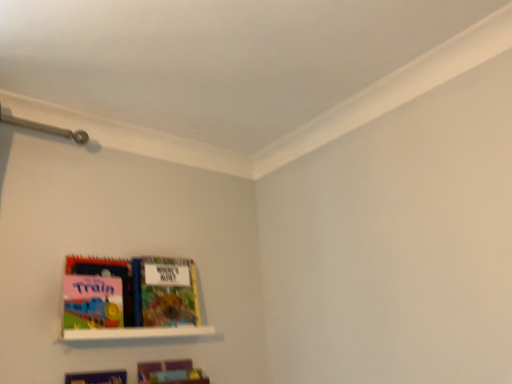
The height and width of the screenshot is (384, 512). What are the coordinates of `matte plastic book at lower left, placed as the 2th book when sorted from top to bottom` in the screenshot? It's located at [170, 372].

You are a GUI agent. You are given a task and a screenshot of the screen. Output one action in this format:
    pyautogui.click(x=<x>, y=<y>)
    Task: Click on the white glossy shelf at lower left
    
    Given the screenshot: What is the action you would take?
    pyautogui.click(x=136, y=333)

Is multicolored paper book at center, marked as the second book in a bottom-to-top arrangement, situated inside white glossy shelf at lower left or outside?

multicolored paper book at center, marked as the second book in a bottom-to-top arrangement, exists outside the volume of white glossy shelf at lower left.

From a real-world perspective, is multicolored paper book at center, which appears as the first book when viewed from the top, positioned above or below white glossy shelf at lower left?

In terms of real-world spatial position, multicolored paper book at center, which appears as the first book when viewed from the top, is above white glossy shelf at lower left.

Is multicolored paper book at center, which appears as the first book when viewed from the top, taller than white glossy shelf at lower left?

Yes, multicolored paper book at center, which appears as the first book when viewed from the top, is taller than white glossy shelf at lower left.

At what (x,y) coordinates should I click in order to perform the action: click on the 2nd book behind the white glossy shelf at lower left, counting from the anchor's position. Please return your answer as a coordinate pair (x, y). Looking at the image, I should click on (164, 292).

Which is more to the left, matte plastic book at lower left, placed as the 2th book when sorted from top to bottom, or multicolored paper book at center, marked as the second book in a bottom-to-top arrangement?

Positioned to the left is multicolored paper book at center, marked as the second book in a bottom-to-top arrangement.

How different are the orientations of matte plastic book at lower left, placed as the 2th book when sorted from top to bottom, and multicolored paper book at center, marked as the second book in a bottom-to-top arrangement, in degrees?

They differ by 1.22 degrees in their facing directions.

Between matte plastic book at lower left, placed as the 2th book when sorted from top to bottom, and multicolored paper book at center, marked as the second book in a bottom-to-top arrangement, which one is positioned in front?

Positioned in front is matte plastic book at lower left, placed as the 2th book when sorted from top to bottom.

Is multicolored paper book at center, marked as the second book in a bottom-to-top arrangement, surrounded by matte plastic book at lower left, placed as the 2th book when sorted from top to bottom?

Actually, multicolored paper book at center, marked as the second book in a bottom-to-top arrangement, is outside matte plastic book at lower left, placed as the 2th book when sorted from top to bottom.

Would you say white glossy shelf at lower left is a long distance from matte plastic book at lower left, placed as the 2th book when sorted from top to bottom?

No, white glossy shelf at lower left is not far from matte plastic book at lower left, placed as the 2th book when sorted from top to bottom.

Who is taller, white glossy shelf at lower left or matte plastic book at lower left, placed as the 2th book when sorted from top to bottom?

With more height is matte plastic book at lower left, placed as the 2th book when sorted from top to bottom.

Which of these two, white glossy shelf at lower left or matte plastic book at lower left, placed as the 2th book when sorted from top to bottom, is bigger?

white glossy shelf at lower left.

Looking at their sizes, would you say white glossy shelf at lower left is wider or thinner than matte plastic book at lower left, marked as the 1th book in a bottom-to-top arrangement?

In the image, white glossy shelf at lower left appears to be wider than matte plastic book at lower left, marked as the 1th book in a bottom-to-top arrangement.

Does multicolored paper book at center, which appears as the first book when viewed from the top, appear on the left side of matte plastic book at lower left, marked as the 1th book in a bottom-to-top arrangement?

Correct, you'll find multicolored paper book at center, which appears as the first book when viewed from the top, to the left of matte plastic book at lower left, marked as the 1th book in a bottom-to-top arrangement.

Find the location of a particular element. This screenshot has height=384, width=512. book behind the matte plastic book at lower left, marked as the 1th book in a bottom-to-top arrangement is located at coordinates (164, 292).

From a real-world perspective, does matte plastic book at lower left, placed as the 2th book when sorted from top to bottom, sit lower than white glossy shelf at lower left?

Yes.

Considering the positions of point (193, 381) and point (64, 332), is point (193, 381) closer or farther from the camera than point (64, 332)?

Point (193, 381) appears to be farther away from the viewer than point (64, 332).

Is matte plastic book at lower left, placed as the 2th book when sorted from top to bottom, facing away from white glossy shelf at lower left?

No, matte plastic book at lower left, placed as the 2th book when sorted from top to bottom, is not facing away from white glossy shelf at lower left.

Can you see matte plastic book at lower left, marked as the 1th book in a bottom-to-top arrangement, touching white glossy shelf at lower left?

No, matte plastic book at lower left, marked as the 1th book in a bottom-to-top arrangement, is not touching white glossy shelf at lower left.

Based on the photo, which of these two, white glossy shelf at lower left or multicolored paper book at center, marked as the second book in a bottom-to-top arrangement, is smaller?

white glossy shelf at lower left is smaller.

Which object is thinner, white glossy shelf at lower left or multicolored paper book at center, which appears as the first book when viewed from the top?

Thinner between the two is multicolored paper book at center, which appears as the first book when viewed from the top.

The height and width of the screenshot is (384, 512). I want to click on book above the white glossy shelf at lower left (from the image's perspective), so click(164, 292).

From the image's perspective, is white glossy shelf at lower left located above or below multicolored paper book at center, which appears as the first book when viewed from the top?

From the image's perspective, white glossy shelf at lower left appears below multicolored paper book at center, which appears as the first book when viewed from the top.

This screenshot has height=384, width=512. Identify the location of book above the white glossy shelf at lower left (from the image's perspective). (164, 292).

This screenshot has height=384, width=512. Identify the location of book that appears on the right of multicolored paper book at center, which appears as the first book when viewed from the top. (170, 372).

When comparing their distances from white glossy shelf at lower left, does matte plastic book at lower left, placed as the 2th book when sorted from top to bottom, or multicolored paper book at center, marked as the second book in a bottom-to-top arrangement, seem closer?

The object closer to white glossy shelf at lower left is multicolored paper book at center, marked as the second book in a bottom-to-top arrangement.

When comparing their distances from white glossy shelf at lower left, does multicolored paper book at center, marked as the second book in a bottom-to-top arrangement, or matte plastic book at lower left, marked as the 1th book in a bottom-to-top arrangement, seem further?

matte plastic book at lower left, marked as the 1th book in a bottom-to-top arrangement, lies further to white glossy shelf at lower left than the other object.

When comparing their distances from matte plastic book at lower left, placed as the 2th book when sorted from top to bottom, does multicolored paper book at center, which appears as the first book when viewed from the top, or white glossy shelf at lower left seem closer?

white glossy shelf at lower left is closer to matte plastic book at lower left, placed as the 2th book when sorted from top to bottom.

Looking at the image, which one is located further to multicolored paper book at center, marked as the second book in a bottom-to-top arrangement, matte plastic book at lower left, marked as the 1th book in a bottom-to-top arrangement, or white glossy shelf at lower left?

matte plastic book at lower left, marked as the 1th book in a bottom-to-top arrangement.

Looking at the image, which one is located closer to matte plastic book at lower left, placed as the 2th book when sorted from top to bottom, white glossy shelf at lower left or multicolored paper book at center, which appears as the first book when viewed from the top?

white glossy shelf at lower left is closer to matte plastic book at lower left, placed as the 2th book when sorted from top to bottom.

Which object lies further to the anchor point multicolored paper book at center, which appears as the first book when viewed from the top, white glossy shelf at lower left or matte plastic book at lower left, placed as the 2th book when sorted from top to bottom?

Among the two, matte plastic book at lower left, placed as the 2th book when sorted from top to bottom, is located further to multicolored paper book at center, which appears as the first book when viewed from the top.

Image resolution: width=512 pixels, height=384 pixels. I want to click on shelf between multicolored paper book at center, marked as the second book in a bottom-to-top arrangement, and matte plastic book at lower left, placed as the 2th book when sorted from top to bottom, vertically, so click(136, 333).